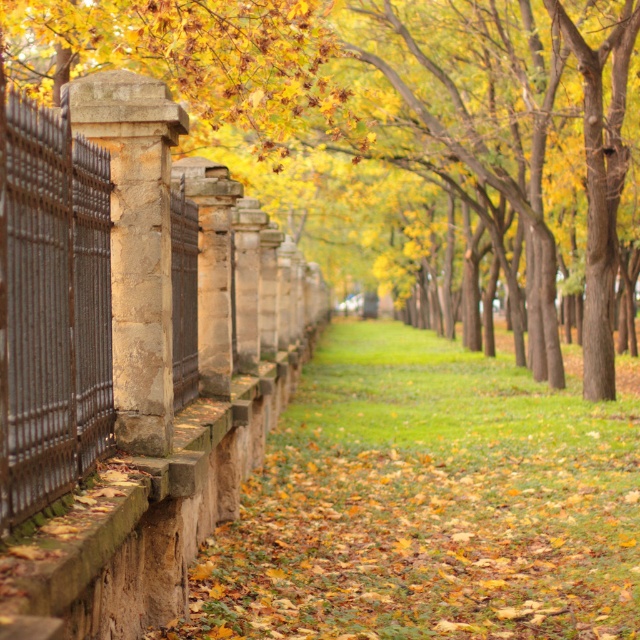
You are standing at the entrance of the pathway and want to walk towards the distant end. As you look at the smooth stone pillar at left, where is it positioned relative to your starting point?

The smooth stone pillar at left is positioned at point 0.208 on the horizontal axis and 0.630 on the vertical axis relative to your starting point.